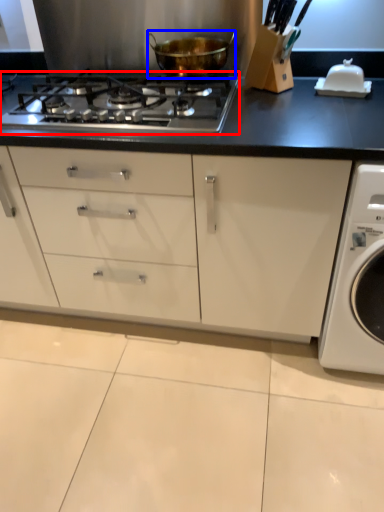
Question: Which of the following is the farthest to the observer, gas stove (highlighted by a red box) or kitchen appliance (highlighted by a blue box)?

Choices:
 (A) gas stove
 (B) kitchen appliance

Answer: (B)